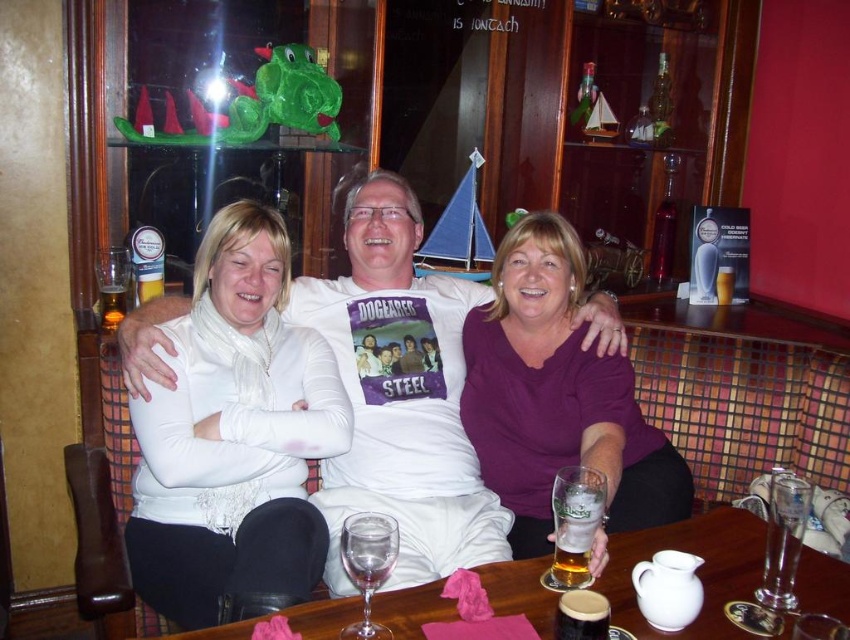
Question: Based on their relative distances, which object is nearer to the amber glass beer at left?

Choices:
 (A) translucent glass beer at center
 (B) translucent glass wine at center

Answer: (B)

Question: Is translucent glass wine at center bigger than translucent glass beer at center?

Choices:
 (A) no
 (B) yes

Answer: (B)

Question: Which of the following is the closest to the observer?

Choices:
 (A) translucent glass wine at center
 (B) purple matte shirt at center
 (C) white matte scarf at upper left

Answer: (A)

Question: Can you confirm if purple matte shirt at center is bigger than translucent glass wine at center?

Choices:
 (A) yes
 (B) no

Answer: (A)

Question: Does translucent glass beer at center have a lesser width compared to amber glass beer at left?

Choices:
 (A) no
 (B) yes

Answer: (B)

Question: Which of the following is the farthest from the observer?

Choices:
 (A) (109, 285)
 (B) (241, 484)
 (C) (613, 513)
 (D) (817, 560)

Answer: (A)